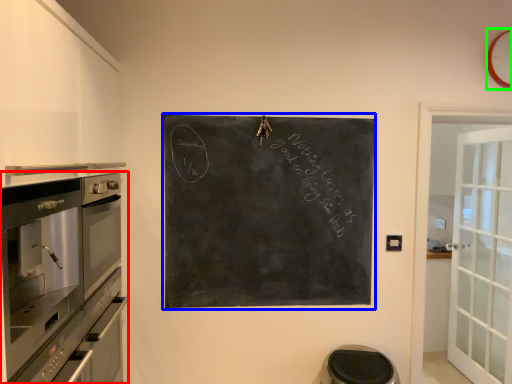
Question: Based on their relative distances, which object is farther from home appliance (highlighted by a red box)? Choose from bulletin board (highlighted by a blue box) and clock (highlighted by a green box).

Choices:
 (A) bulletin board
 (B) clock

Answer: (B)